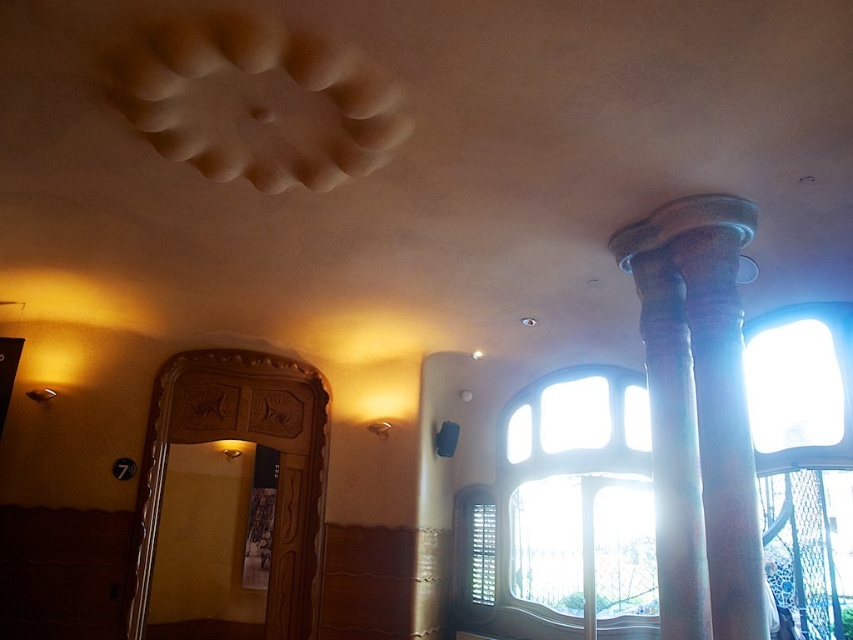
Question: Which object appears closest to the camera in this image?

Choices:
 (A) smooth stone column at right
 (B) clear glass window at center

Answer: (A)

Question: Which of the following is the farthest from the observer?

Choices:
 (A) clear glass window at center
 (B) smooth stone column at right

Answer: (A)

Question: Can you confirm if smooth stone column at right is bigger than clear glass window at center?

Choices:
 (A) no
 (B) yes

Answer: (A)

Question: Is smooth stone column at right below clear glass window at center?

Choices:
 (A) no
 (B) yes

Answer: (A)

Question: Is smooth stone column at right bigger than clear glass window at center?

Choices:
 (A) no
 (B) yes

Answer: (A)

Question: Which of the following is the closest to the observer?

Choices:
 (A) (619, 579)
 (B) (726, 225)

Answer: (B)